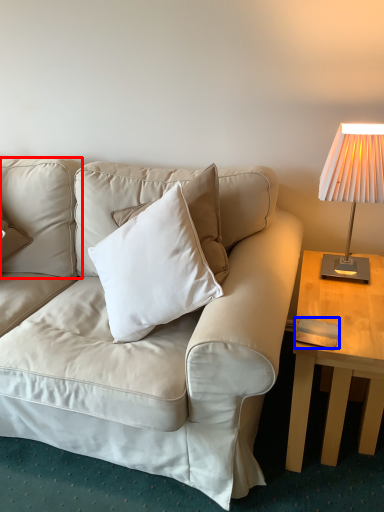
Question: Which of the following is the closest to the observer, pillow (highlighted by a red box) or pad (highlighted by a blue box)?

Choices:
 (A) pillow
 (B) pad

Answer: (B)